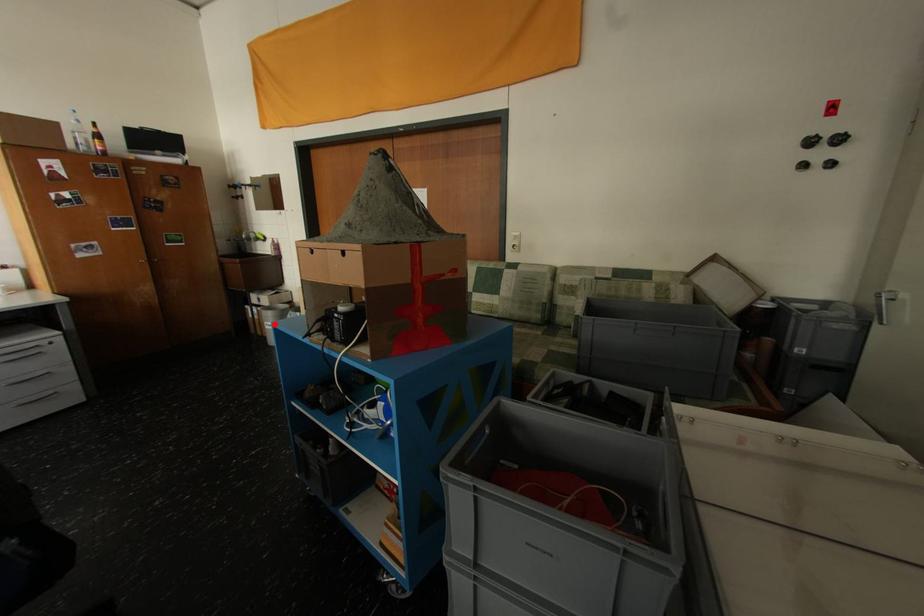
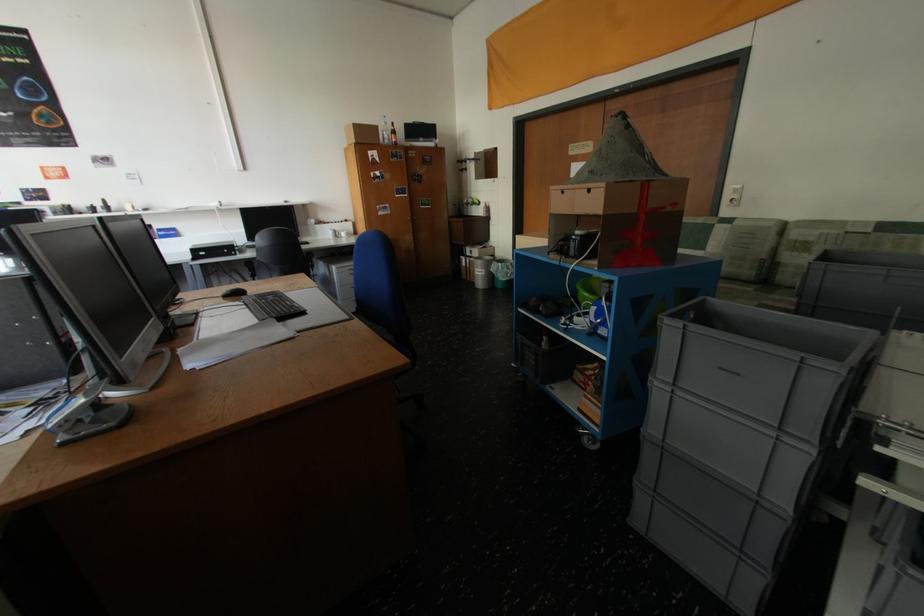
The point at the highlighted location is marked in the first image. Where is the corresponding point in the second image?

(484, 270)